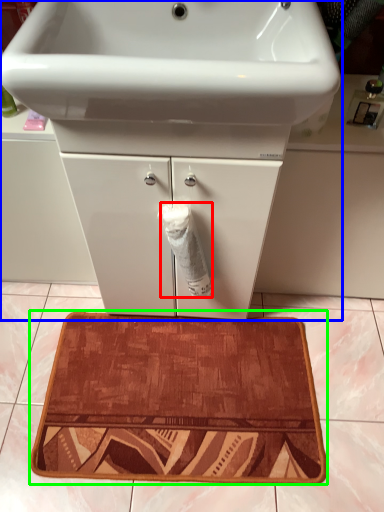
Question: Which object is the closest to the toilet paper (highlighted by a red box)? Choose among these: bathroom cabinet (highlighted by a blue box) or bath mat (highlighted by a green box).

Choices:
 (A) bathroom cabinet
 (B) bath mat

Answer: (A)